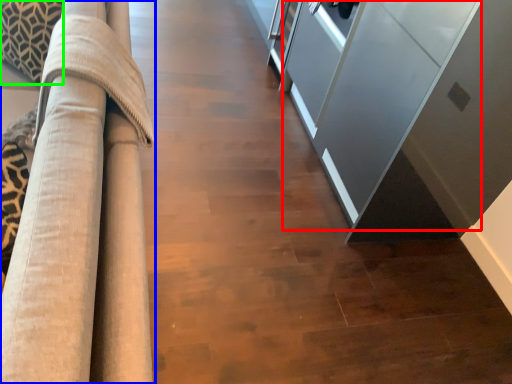
Question: Which object is the closest to the glass door (highlighted by a red box)? Choose among these: furniture (highlighted by a blue box) or pillow (highlighted by a green box).

Choices:
 (A) furniture
 (B) pillow

Answer: (A)